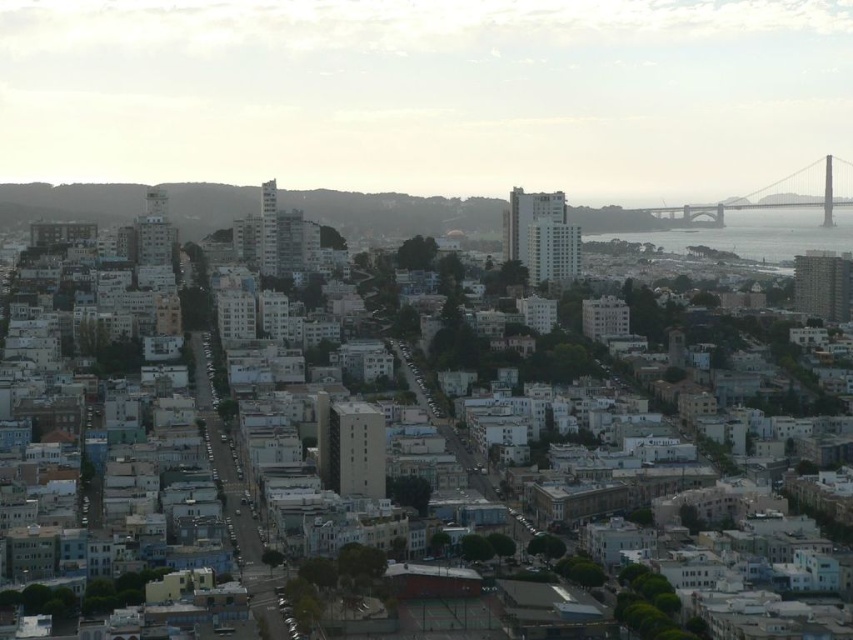
Who is positioned more to the right, clear water at lower right or gray concrete bridge at upper right?

gray concrete bridge at upper right

Locate an element on the screen. clear water at lower right is located at coordinates [752, 234].

The width and height of the screenshot is (853, 640). I want to click on clear water at lower right, so click(752, 234).